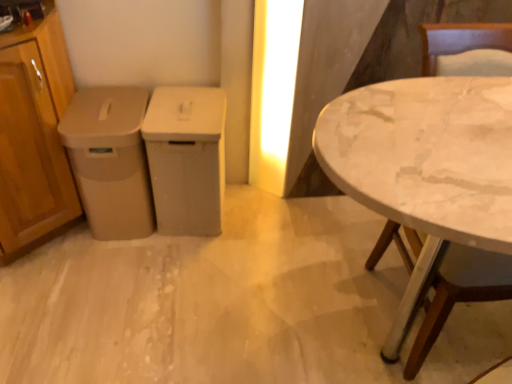
Find the location of a particular element. The height and width of the screenshot is (384, 512). free space above white marble table at right (from a real-world perspective) is located at coordinates point(450,139).